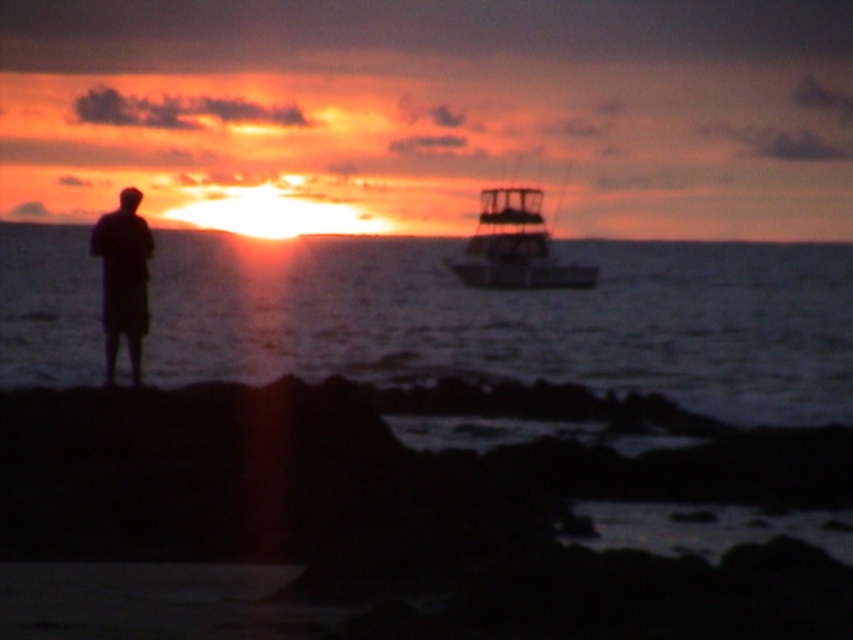
Question: Which object appears farthest from the camera in this image?

Choices:
 (A) metallic silver boat at upper right
 (B) black matte figure at left

Answer: (A)

Question: Is metallic silver boat at upper right bigger than black matte figure at left?

Choices:
 (A) no
 (B) yes

Answer: (B)

Question: Which point is farther to the camera?

Choices:
 (A) (135, 259)
 (B) (495, 205)

Answer: (B)

Question: From the image, what is the correct spatial relationship of metallic silver boat at upper right in relation to black matte figure at left?

Choices:
 (A) left
 (B) right

Answer: (B)

Question: Can you confirm if metallic silver boat at upper right is positioned to the left of black matte figure at left?

Choices:
 (A) no
 (B) yes

Answer: (A)

Question: Which object appears closest to the camera in this image?

Choices:
 (A) black matte figure at left
 (B) metallic silver boat at upper right

Answer: (A)